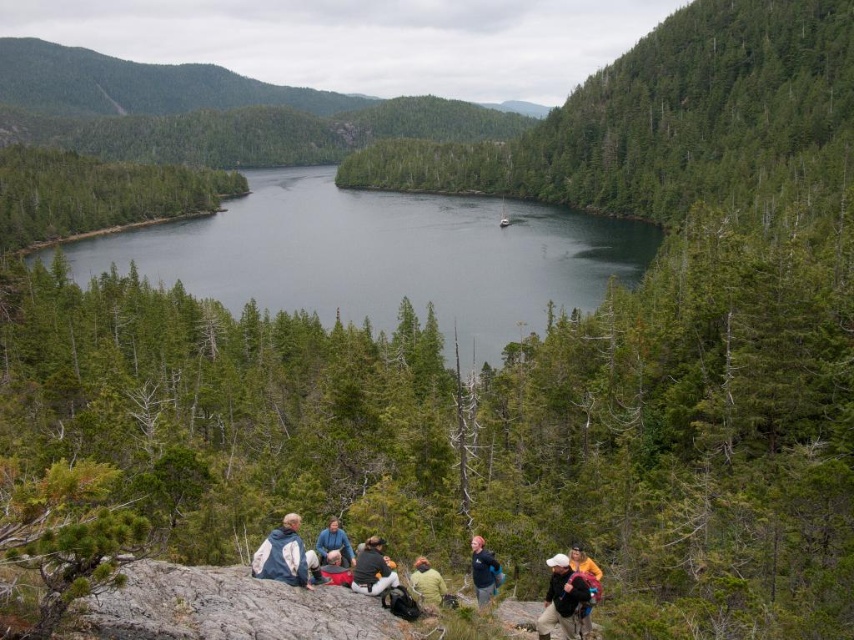
You are standing at the edge of the rocky outcrop where the group is gathered. If you look directly ahead, will you see the dark green water at center?

Yes, because the dark green water at center is located at the central point of the image, which would be directly ahead from your position at the edge of the rocky outcrop.

You are a hiker standing at the edge of the rocky outcrop. You see the dark green water at center and the blue fabric jacket at center. Which object is positioned to the left of the other?

The dark green water at center is to the left of the blue fabric jacket at center.